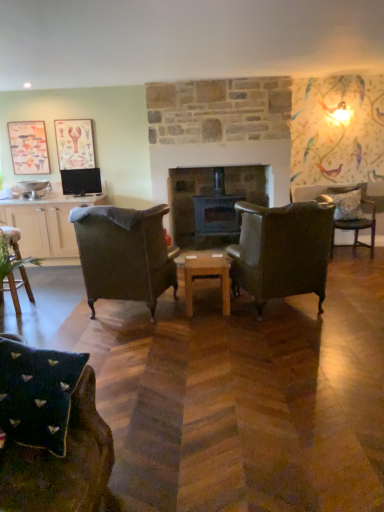
Question: Should I look upward or downward to see wooden at center?

Choices:
 (A) down
 (B) up

Answer: (A)

Question: Is matte wooden picture frame at upper left, the first picture frame in the left-to-right sequence, surrounded by white textured pillow at right?

Choices:
 (A) no
 (B) yes

Answer: (A)

Question: From a real-world perspective, is white textured pillow at right on matte wooden picture frame at upper left, the second picture frame positioned from the right?

Choices:
 (A) yes
 (B) no

Answer: (B)

Question: Does white textured pillow at right have a larger size compared to matte wooden picture frame at upper left, the first picture frame in the left-to-right sequence?

Choices:
 (A) yes
 (B) no

Answer: (A)

Question: Could you tell me if white textured pillow at right is facing matte wooden picture frame at upper left, the second picture frame positioned from the right?

Choices:
 (A) yes
 (B) no

Answer: (B)

Question: Does white textured pillow at right have a lesser height compared to matte wooden picture frame at upper left, the second picture frame positioned from the right?

Choices:
 (A) no
 (B) yes

Answer: (B)

Question: Is white textured pillow at right looking in the opposite direction of matte wooden picture frame at upper left, the first picture frame in the left-to-right sequence?

Choices:
 (A) yes
 (B) no

Answer: (B)

Question: Can you confirm if white textured pillow at right is thinner than wooden chair at lower left, which is counted as the 1th chair, starting from the left?

Choices:
 (A) no
 (B) yes

Answer: (B)

Question: Does white textured pillow at right turn towards wooden chair at lower left, positioned as the fourth chair in front-to-back order?

Choices:
 (A) no
 (B) yes

Answer: (A)

Question: From the image's perspective, is white textured pillow at right over wooden chair at lower left, which is counted as the 1th chair, starting from the left?

Choices:
 (A) yes
 (B) no

Answer: (A)

Question: Can you confirm if white textured pillow at right is taller than wooden chair at lower left, positioned as the fourth chair in front-to-back order?

Choices:
 (A) yes
 (B) no

Answer: (B)

Question: Does white textured pillow at right have a larger size compared to wooden chair at lower left, arranged as the second chair when viewed from the back?

Choices:
 (A) no
 (B) yes

Answer: (A)

Question: Is the position of white textured pillow at right less distant than that of wooden chair at lower left, which is counted as the 1th chair, starting from the left?

Choices:
 (A) yes
 (B) no

Answer: (B)

Question: Is dark gray stone fireplace at center a part of matte paper picture frame at upper left, the 1th picture frame when ordered from right to left?

Choices:
 (A) yes
 (B) no

Answer: (B)